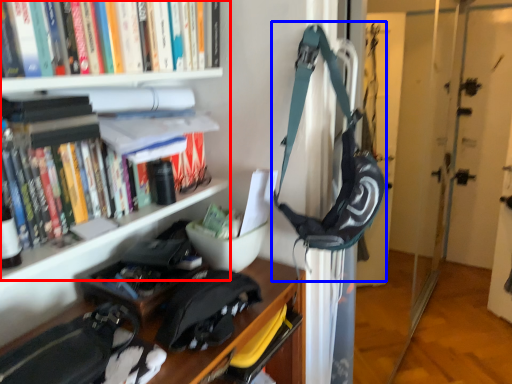
Question: Which of the following is the closest to the observer, bookcase (highlighted by a red box) or shoulder bag (highlighted by a blue box)?

Choices:
 (A) bookcase
 (B) shoulder bag

Answer: (A)